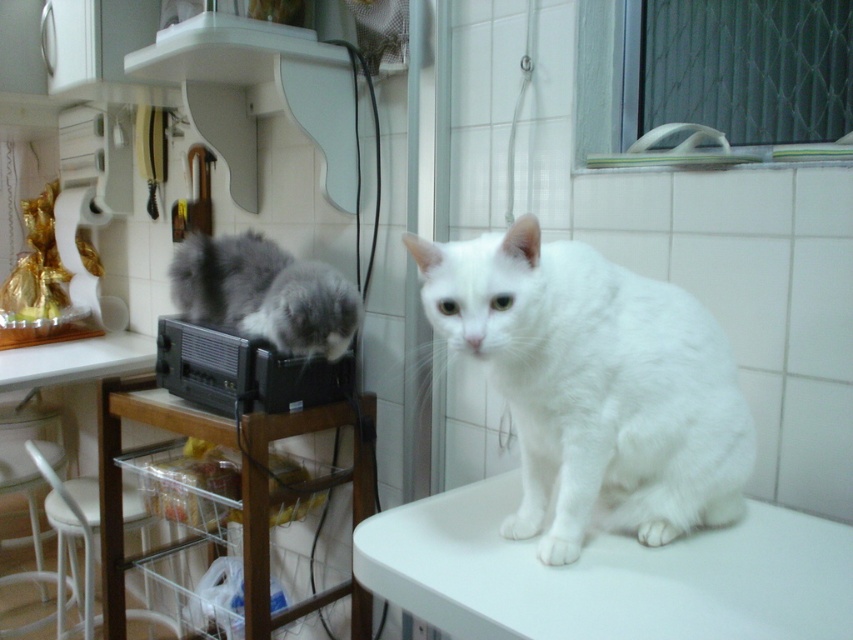
Can you confirm if white fluffy cat at center is wider than fluffy gray cat at left?

No, white fluffy cat at center is not wider than fluffy gray cat at left.

Is point (587, 504) less distant than point (231, 310)?

Yes, it is.

At what (x,y) coordinates should I click in order to perform the action: click on white fluffy cat at center. Please return your answer as a coordinate pair (x, y). This screenshot has height=640, width=853. Looking at the image, I should click on (595, 387).

The height and width of the screenshot is (640, 853). Find the location of `white fluffy cat at center`. white fluffy cat at center is located at coordinates (595, 387).

Image resolution: width=853 pixels, height=640 pixels. Describe the element at coordinates (606, 573) in the screenshot. I see `white smooth table at center` at that location.

How much distance is there between white smooth table at center and white plastic table at lower left?

white smooth table at center is 5.13 feet from white plastic table at lower left.

Find the location of a particular element. This screenshot has height=640, width=853. white smooth table at center is located at coordinates (606, 573).

Looking at this image, between transparent plastic table at lower left and white plastic table at lower left, which one has more height?

transparent plastic table at lower left

Does transparent plastic table at lower left have a greater height compared to white plastic table at lower left?

Correct, transparent plastic table at lower left is much taller as white plastic table at lower left.

The width and height of the screenshot is (853, 640). What do you see at coordinates (242, 477) in the screenshot? I see `transparent plastic table at lower left` at bounding box center [242, 477].

Find the location of a particular element. This screenshot has width=853, height=640. transparent plastic table at lower left is located at coordinates (242, 477).